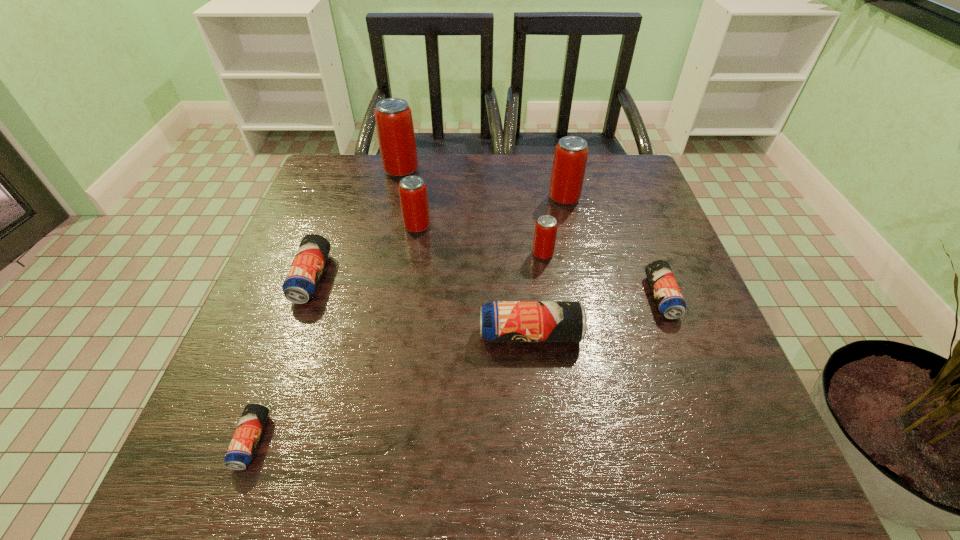
This screenshot has width=960, height=540. Identify the location of blue beer can that is the third closest to the farthest beer can. (669, 299).

You are a GUI agent. You are given a task and a screenshot of the screen. Output one action in this format:
    pyautogui.click(x=<x>, y=<y>)
    Task: Click on the blue beer can that stands as the closest to the second farthest pink beer can
    The height and width of the screenshot is (540, 960).
    Given the screenshot: What is the action you would take?
    pyautogui.click(x=669, y=299)

I want to click on free location that satisfies the following two spatial constraints: 1. on the back side of the farthest pink beer can; 2. on the left side of the shortest object, so click(x=351, y=170).